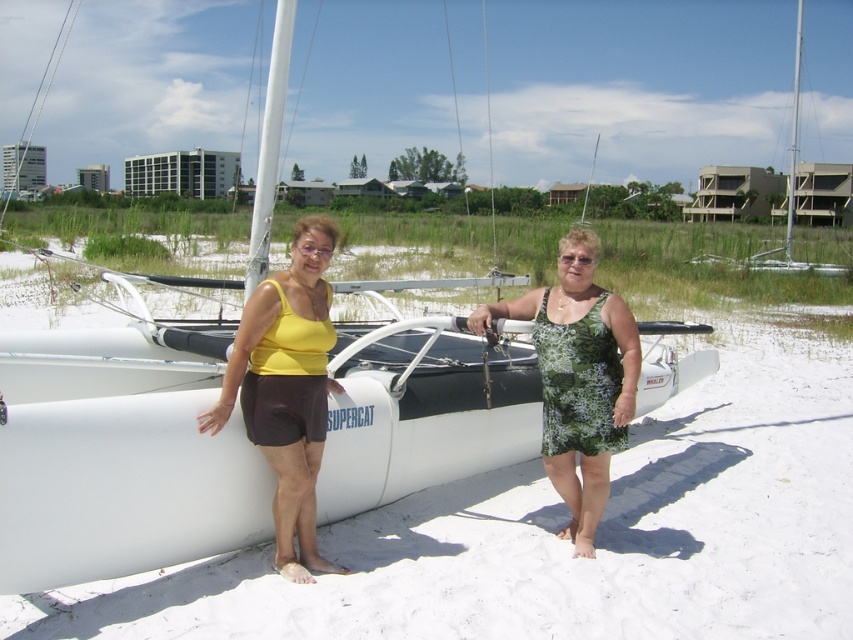
Question: Is yellow fabric tank top at center smaller than white plastic sailboat at upper right?

Choices:
 (A) yes
 (B) no

Answer: (A)

Question: Estimate the real-world distances between objects in this image. Which object is farther from the white plastic sailboat at upper right?

Choices:
 (A) green floral dress at center
 (B) yellow fabric tank top at center

Answer: (B)

Question: Does white matte catamaran at center have a larger size compared to yellow fabric tank top at center?

Choices:
 (A) yes
 (B) no

Answer: (A)

Question: Which object appears closest to the camera in this image?

Choices:
 (A) green floral dress at center
 (B) white plastic sailboat at upper right

Answer: (A)

Question: Among these objects, which one is nearest to the camera?

Choices:
 (A) white plastic sailboat at upper right
 (B) yellow fabric tank top at center

Answer: (B)

Question: Does yellow fabric tank top at center appear under green floral dress at center?

Choices:
 (A) yes
 (B) no

Answer: (B)